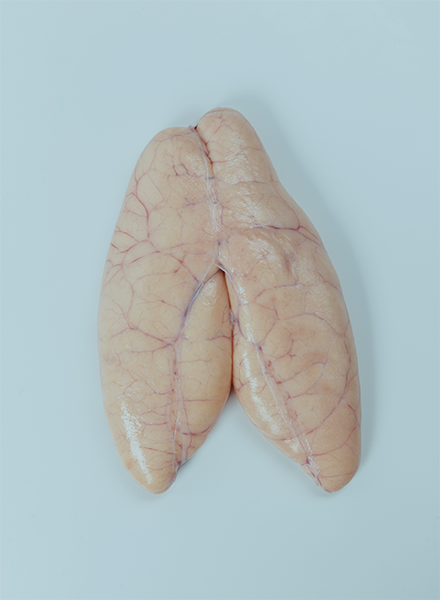
This screenshot has height=600, width=440. I want to click on tan tissue, so click(x=193, y=416).